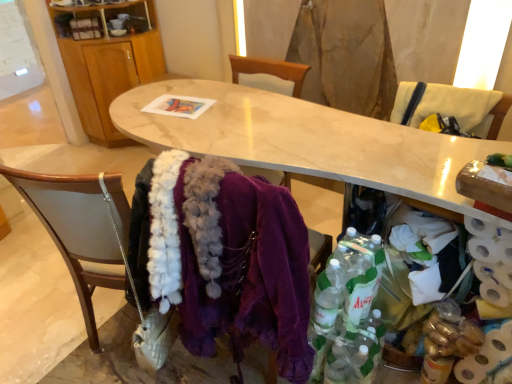
Locate an element on the screen. Image resolution: width=512 pixels, height=384 pixels. translucent plastic bottles at lower right is located at coordinates (347, 312).

Image resolution: width=512 pixels, height=384 pixels. Describe the element at coordinates (306, 139) in the screenshot. I see `marble table at center` at that location.

What is the approximate height of wooden chair at lower left, which ranks as the first chair in left-to-right order?

39.03 inches.

Measure the distance between point (38, 290) and camera.

7.38 feet.

Describe the element at coordinates (106, 62) in the screenshot. I see `wooden cabinet at upper left` at that location.

Where is `white fabric chair at upper right, placed as the first chair when sorted from right to left`? This screenshot has width=512, height=384. white fabric chair at upper right, placed as the first chair when sorted from right to left is located at coordinates (461, 107).

You are a GUI agent. You are given a task and a screenshot of the screen. Output one action in this format:
    pyautogui.click(x=<x>, y=<y>)
    Task: Click on the white textured toilet paper at lower right
    
    Given the screenshot: What is the action you would take?
    pyautogui.click(x=489, y=359)

From the image's perspective, which is above, wooden chair at lower left, which ranks as the first chair in left-to-right order, or white fabric chair at upper right, which is the 1th chair in top-to-bottom order?

From the image's view, white fabric chair at upper right, which is the 1th chair in top-to-bottom order, is above.

In order to click on chair that is above the wooden chair at lower left, which ranks as the first chair in left-to-right order (from the image's perspective) in this screenshot , I will do `click(461, 107)`.

Which is in front, point (27, 355) or point (490, 94)?

Point (490, 94)

How far apart are white fabric chair at upper right, which ranks as the second chair in bottom-to-top order, and marble table at center?

white fabric chair at upper right, which ranks as the second chair in bottom-to-top order, and marble table at center are 16.22 inches apart from each other.

Is white fabric chair at upper right, placed as the second chair when sorted from left to right, situated inside marble table at center or outside?

white fabric chair at upper right, placed as the second chair when sorted from left to right, exists outside the volume of marble table at center.

Does white fabric chair at upper right, placed as the first chair when sorted from right to left, have a larger size compared to marble table at center?

No, white fabric chair at upper right, placed as the first chair when sorted from right to left, is not bigger than marble table at center.

Considering the relative sizes of white fabric chair at upper right, placed as the first chair when sorted from right to left, and marble table at center in the image provided, is white fabric chair at upper right, placed as the first chair when sorted from right to left, thinner than marble table at center?

Correct, the width of white fabric chair at upper right, placed as the first chair when sorted from right to left, is less than that of marble table at center.

Is point (399, 131) positioned behind point (409, 96)?

No, (399, 131) is closer to viewer.

Looking at the image, does marble table at center seem bigger or smaller compared to white fabric chair at upper right, placed as the second chair when sorted from left to right?

Considering their sizes, marble table at center takes up more space than white fabric chair at upper right, placed as the second chair when sorted from left to right.

The width and height of the screenshot is (512, 384). I want to click on cabinetry to the left of wooden chair at lower left, marked as the 1th chair in a bottom-to-top arrangement, so click(106, 62).

How distant is wooden cabinet at upper left from wooden chair at lower left, which is counted as the 2th chair, starting from the top?

wooden cabinet at upper left and wooden chair at lower left, which is counted as the 2th chair, starting from the top, are 4.25 feet apart from each other.

Can you confirm if wooden cabinet at upper left is thinner than wooden chair at lower left, which ranks as the first chair in left-to-right order?

Yes, wooden cabinet at upper left is thinner than wooden chair at lower left, which ranks as the first chair in left-to-right order.

From a real-world perspective, between white fabric chair at upper right, placed as the second chair when sorted from left to right, and wooden chair at lower left, which appears as the 2th chair when viewed from the right, who is vertically higher?

In real-world perspective, white fabric chair at upper right, placed as the second chair when sorted from left to right, is above.

Does white fabric chair at upper right, which is the 1th chair in top-to-bottom order, come behind wooden chair at lower left, which appears as the 2th chair when viewed from the right?

Yes, the depth of white fabric chair at upper right, which is the 1th chair in top-to-bottom order, is greater than that of wooden chair at lower left, which appears as the 2th chair when viewed from the right.

You are a GUI agent. You are given a task and a screenshot of the screen. Output one action in this format:
    pyautogui.click(x=<x>, y=<y>)
    Task: Click on the chair below the white fabric chair at upper right, placed as the second chair when sorted from left to right (from the image's perspective)
    The width and height of the screenshot is (512, 384).
    Given the screenshot: What is the action you would take?
    pyautogui.click(x=54, y=274)

Is wooden chair at lower left, which ranks as the first chair in left-to-right order, completely or partially inside white fabric chair at upper right, placed as the second chair when sorted from left to right?

No, wooden chair at lower left, which ranks as the first chair in left-to-right order, is not inside white fabric chair at upper right, placed as the second chair when sorted from left to right.

From the image's perspective, who appears lower, marble table at center or wooden cabinet at upper left?

From the image's view, marble table at center is below.

From the picture: Is marble table at center not close to wooden cabinet at upper left?

Yes, marble table at center and wooden cabinet at upper left are quite far apart.

Could wooden cabinet at upper left be considered to be inside marble table at center?

No.

Is marble table at center far from wooden armchair at right?

They are positioned close to each other.

Which is more to the left, marble table at center or wooden armchair at right?

From the viewer's perspective, marble table at center appears more on the left side.

I want to click on desk below the wooden armchair at right (from a real-world perspective), so click(x=306, y=139).

Which of these two, marble table at center or wooden armchair at right, is wider?

With larger width is marble table at center.

Image resolution: width=512 pixels, height=384 pixels. What are the coordinates of `chair above the wooden chair at lower left, marked as the 1th chair in a bottom-to-top arrangement (from a real-world perspective)` in the screenshot? It's located at (461, 107).

This screenshot has height=384, width=512. I want to click on desk below the white fabric chair at upper right, placed as the first chair when sorted from right to left (from the image's perspective), so click(306, 139).

Looking at the image, which one is located further to wooden armchair at right, marble table at center or white fabric chair at upper right, placed as the first chair when sorted from right to left?

The object further to wooden armchair at right is marble table at center.

In the scene shown: Which object lies nearer to the anchor point white textured toilet paper at lower right, white fabric chair at upper right, which ranks as the second chair in bottom-to-top order, or wooden chair at lower left, which is counted as the 2th chair, starting from the top?

white fabric chair at upper right, which ranks as the second chair in bottom-to-top order, is closer to white textured toilet paper at lower right.

Which object lies further to the anchor point white fabric chair at upper right, which ranks as the second chair in bottom-to-top order, white textured toilet paper at lower right or translucent plastic bottles at lower right?

white textured toilet paper at lower right is further to white fabric chair at upper right, which ranks as the second chair in bottom-to-top order.

When comparing their distances from wooden cabinet at upper left, does white fabric chair at upper right, placed as the first chair when sorted from right to left, or wooden chair at lower left, marked as the 1th chair in a bottom-to-top arrangement, seem closer?

wooden chair at lower left, marked as the 1th chair in a bottom-to-top arrangement, lies closer to wooden cabinet at upper left than the other object.

From the image, which object appears to be farther from white fabric chair at upper right, which is the 1th chair in top-to-bottom order, marble table at center or white textured toilet paper at lower right?

white textured toilet paper at lower right lies further to white fabric chair at upper right, which is the 1th chair in top-to-bottom order, than the other object.

Which object lies further to the anchor point white textured toilet paper at lower right, marble table at center or wooden chair at lower left, which appears as the 2th chair when viewed from the right?

wooden chair at lower left, which appears as the 2th chair when viewed from the right, lies further to white textured toilet paper at lower right than the other object.

Looking at the image, which one is located further to translucent plastic bottles at lower right, wooden cabinet at upper left or white fabric chair at upper right, placed as the first chair when sorted from right to left?

Among the two, wooden cabinet at upper left is located further to translucent plastic bottles at lower right.

From the image, which object appears to be nearer to white fabric chair at upper right, which is the 1th chair in top-to-bottom order, wooden chair at lower left, marked as the 1th chair in a bottom-to-top arrangement, or marble table at center?

marble table at center lies closer to white fabric chair at upper right, which is the 1th chair in top-to-bottom order, than the other object.

At what (x,y) coordinates should I click in order to perform the action: click on desk located between wooden chair at lower left, which is counted as the 2th chair, starting from the top, and white textured toilet paper at lower right in the left-right direction. Please return your answer as a coordinate pair (x, y). The image size is (512, 384). Looking at the image, I should click on (306, 139).

Locate an element on the screen. bottle between white fabric chair at upper right, placed as the second chair when sorted from left to right, and white textured toilet paper at lower right vertically is located at coordinates (347, 312).

Where is `bottle between marble table at center and wooden cabinet at upper left from front to back`? The image size is (512, 384). bottle between marble table at center and wooden cabinet at upper left from front to back is located at coordinates (347, 312).

This screenshot has height=384, width=512. I want to click on desk located between wooden chair at lower left, marked as the 1th chair in a bottom-to-top arrangement, and wooden cabinet at upper left in the depth direction, so click(306, 139).